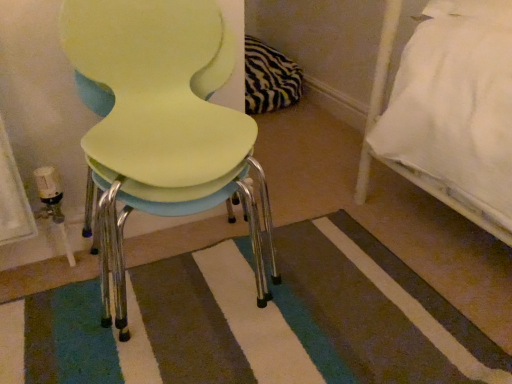
Question: Looking at their shapes, would you say striped carpet at center is wider or thinner than matte yellow chair at center?

Choices:
 (A) thin
 (B) wide

Answer: (B)

Question: Considering the positions of point (436, 377) and point (199, 72), is point (436, 377) closer or farther from the camera than point (199, 72)?

Choices:
 (A) closer
 (B) farther

Answer: (A)

Question: In terms of height, does striped carpet at center look taller or shorter compared to matte yellow chair at center?

Choices:
 (A) tall
 (B) short

Answer: (B)

Question: From the image's perspective, is matte yellow chair at center positioned above or below striped carpet at center?

Choices:
 (A) above
 (B) below

Answer: (A)

Question: Considering the relative positions of matte yellow chair at center and striped carpet at center in the image provided, is matte yellow chair at center to the left or to the right of striped carpet at center?

Choices:
 (A) left
 (B) right

Answer: (A)

Question: From a real-world perspective, is matte yellow chair at center physically located above or below striped carpet at center?

Choices:
 (A) above
 (B) below

Answer: (A)

Question: Is point (161, 44) closer or farther from the camera than point (154, 316)?

Choices:
 (A) closer
 (B) farther

Answer: (A)